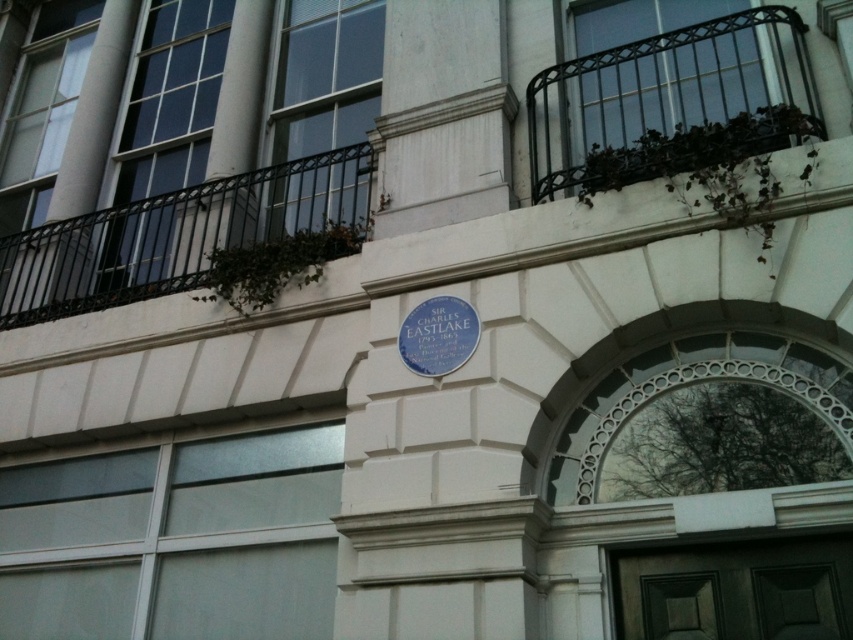
Does black wrought iron balcony at upper right appear under blue plaque at center?

No.

Between black wrought iron balcony at upper right and blue plaque at center, which one has more height?

With more height is black wrought iron balcony at upper right.

Does point (653, 48) come farther from viewer compared to point (431, 358)?

Yes, it is behind point (431, 358).

Find the location of a particular element. black wrought iron balcony at upper right is located at coordinates (663, 88).

The width and height of the screenshot is (853, 640). Identify the location of black wrought iron balcony at upper left. (173, 236).

Does black wrought iron balcony at upper left appear over blue plaque at center?

Indeed, black wrought iron balcony at upper left is positioned over blue plaque at center.

Who is more forward, (21, 317) or (424, 340)?

Positioned in front is point (424, 340).

Locate an element on the screen. black wrought iron balcony at upper left is located at coordinates (173, 236).

Can you confirm if black wrought iron balcony at upper right is positioned above dark wood door at lower center?

Correct, black wrought iron balcony at upper right is located above dark wood door at lower center.

The image size is (853, 640). Describe the element at coordinates (663, 88) in the screenshot. I see `black wrought iron balcony at upper right` at that location.

This screenshot has height=640, width=853. Identify the location of black wrought iron balcony at upper right. (663, 88).

This screenshot has width=853, height=640. I want to click on black wrought iron balcony at upper right, so click(663, 88).